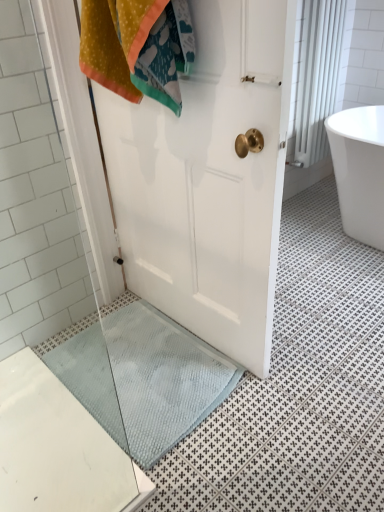
Question: Considering the relative sizes of white textured curtain at upper right and light blue textured bath mat at lower center in the image provided, is white textured curtain at upper right taller than light blue textured bath mat at lower center?

Choices:
 (A) no
 (B) yes

Answer: (B)

Question: Does white textured curtain at upper right come in front of light blue textured bath mat at lower center?

Choices:
 (A) no
 (B) yes

Answer: (A)

Question: Is white textured curtain at upper right thinner than light blue textured bath mat at lower center?

Choices:
 (A) yes
 (B) no

Answer: (A)

Question: Considering the relative sizes of white textured curtain at upper right and light blue textured bath mat at lower center in the image provided, is white textured curtain at upper right bigger than light blue textured bath mat at lower center?

Choices:
 (A) no
 (B) yes

Answer: (B)

Question: Is white textured curtain at upper right at the left side of light blue textured bath mat at lower center?

Choices:
 (A) no
 (B) yes

Answer: (A)

Question: Can you confirm if white textured curtain at upper right is positioned to the right of light blue textured bath mat at lower center?

Choices:
 (A) yes
 (B) no

Answer: (A)

Question: Considering the relative positions of white textured curtain at upper right and white glossy bathtub at right in the image provided, is white textured curtain at upper right in front of white glossy bathtub at right?

Choices:
 (A) no
 (B) yes

Answer: (A)

Question: Is white textured curtain at upper right thinner than white glossy bathtub at right?

Choices:
 (A) yes
 (B) no

Answer: (A)

Question: From a real-world perspective, is white textured curtain at upper right on white glossy bathtub at right?

Choices:
 (A) yes
 (B) no

Answer: (A)

Question: Is white textured curtain at upper right wider than white glossy bathtub at right?

Choices:
 (A) yes
 (B) no

Answer: (B)

Question: From the image's perspective, would you say white textured curtain at upper right is shown under white glossy bathtub at right?

Choices:
 (A) no
 (B) yes

Answer: (A)

Question: Can you confirm if white textured curtain at upper right is bigger than white glossy bathtub at right?

Choices:
 (A) yes
 (B) no

Answer: (B)

Question: From the image's perspective, is light blue textured bath mat at lower center over white textured curtain at upper right?

Choices:
 (A) yes
 (B) no

Answer: (B)